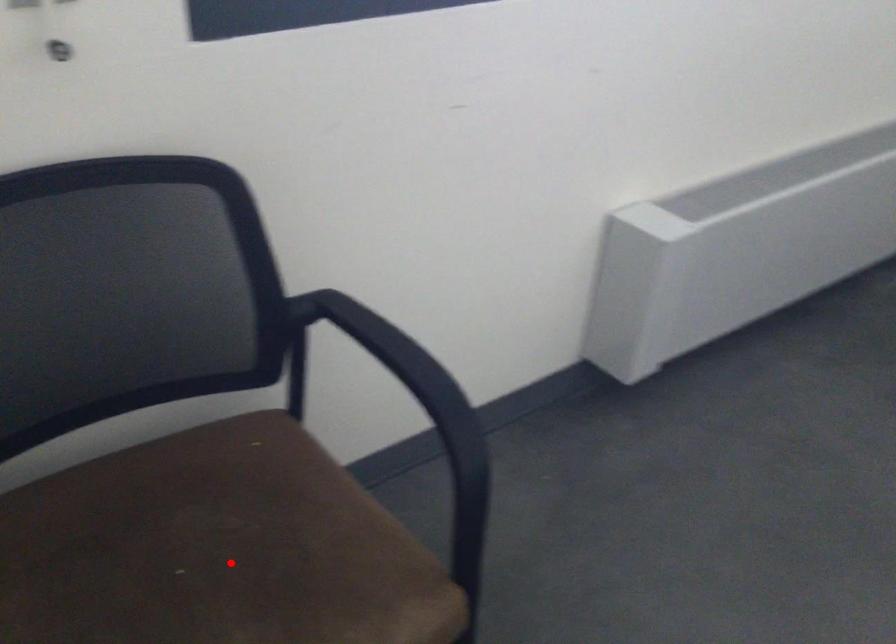
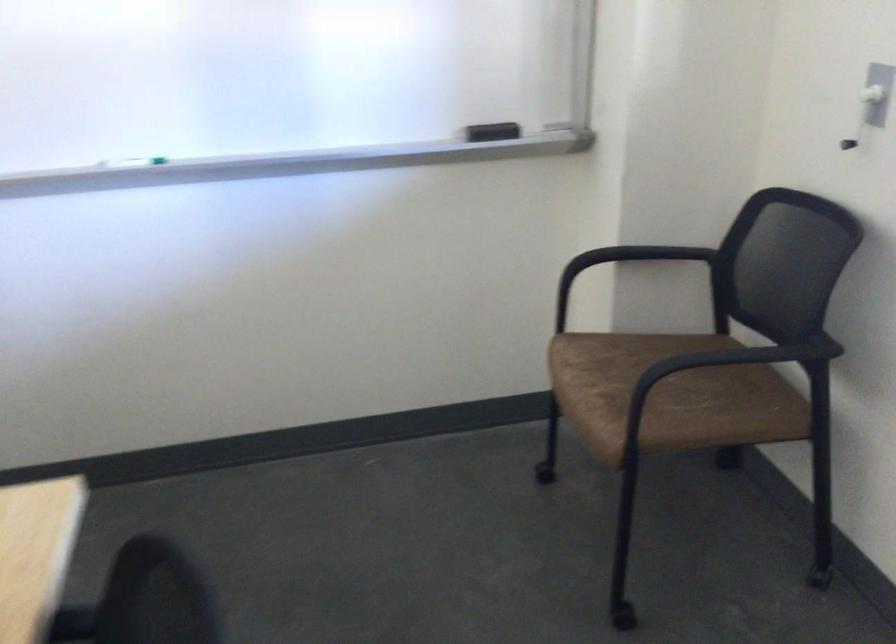
The point at the highlighted location is marked in the first image. Where is the corresponding point in the second image?

(669, 395)